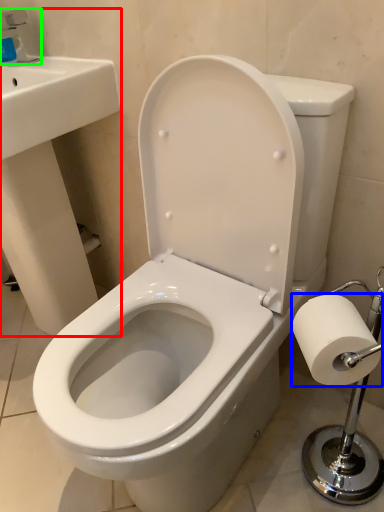
Question: Considering the real-world distances, which object is closest to sink (highlighted by a red box)? toilet paper (highlighted by a blue box) or faucet (highlighted by a green box).

Choices:
 (A) toilet paper
 (B) faucet

Answer: (B)